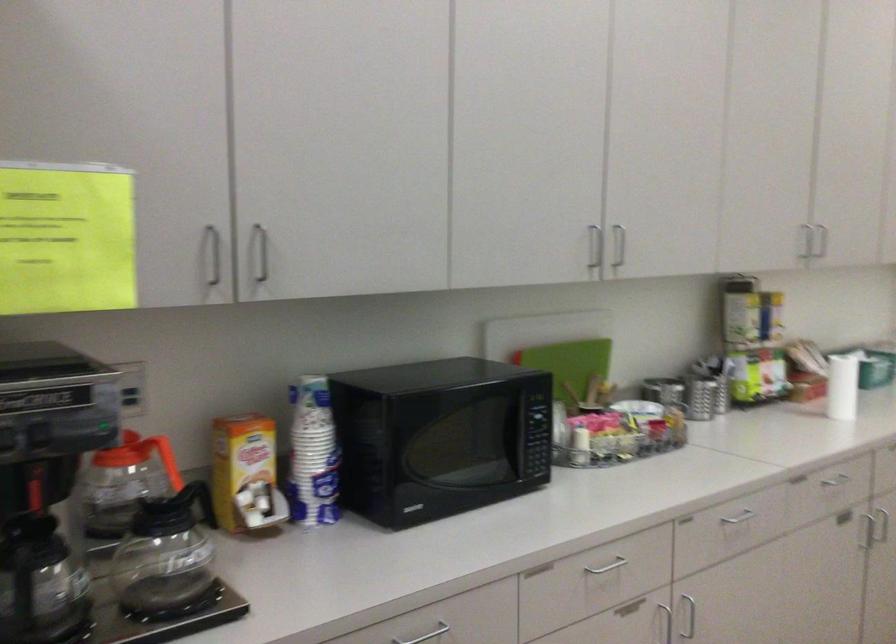
Locate an element on the screen. This screenshot has height=644, width=896. orange coffee pot handle is located at coordinates (165, 459).